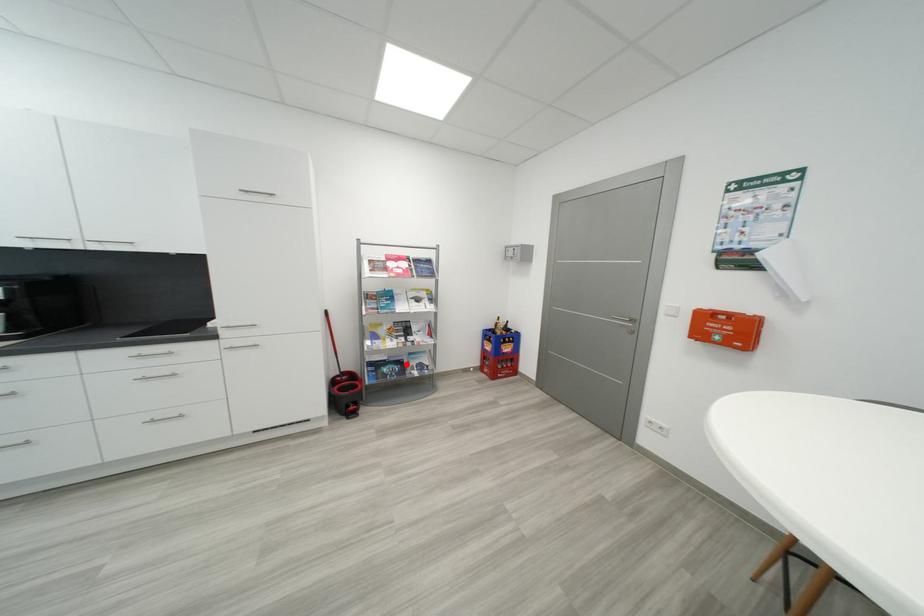
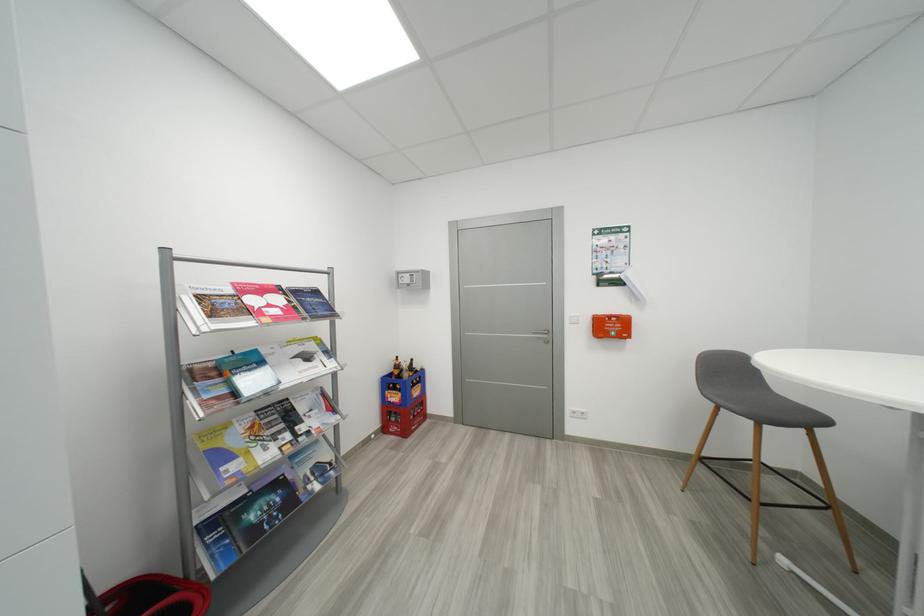
In the second image, find the point that corresponds to the highlighted location in the first image.

(285, 485)